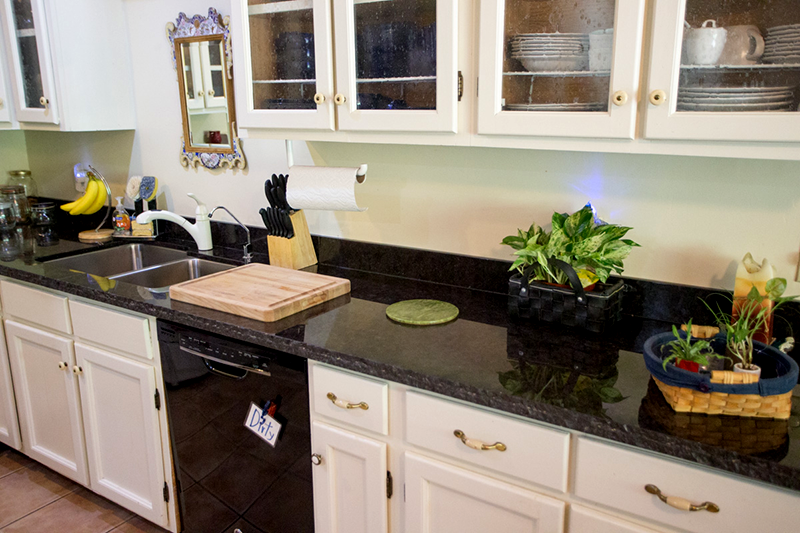
The height and width of the screenshot is (533, 800). I want to click on opaque cabinets, so click(45, 377), click(110, 378), click(357, 471), click(434, 499).